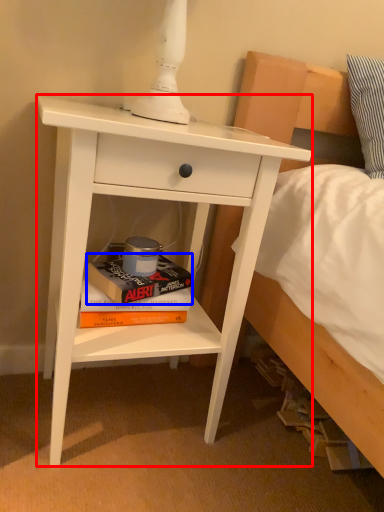
Question: Which point is closer to the camera, nightstand (highlighted by a red box) or paperback book (highlighted by a blue box)?

Choices:
 (A) nightstand
 (B) paperback book

Answer: (A)